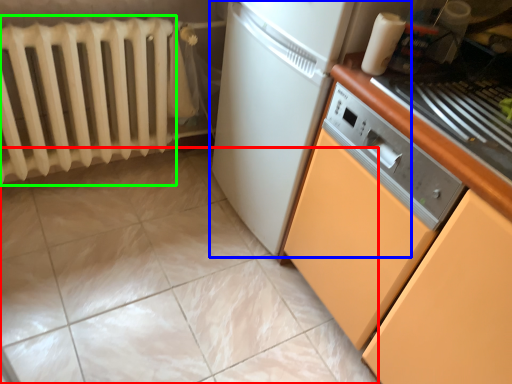
Question: Which object is the farthest from ceramic tile (highlighted by a red box)? Choose among these: home appliance (highlighted by a blue box) or radiator (highlighted by a green box).

Choices:
 (A) home appliance
 (B) radiator

Answer: (A)